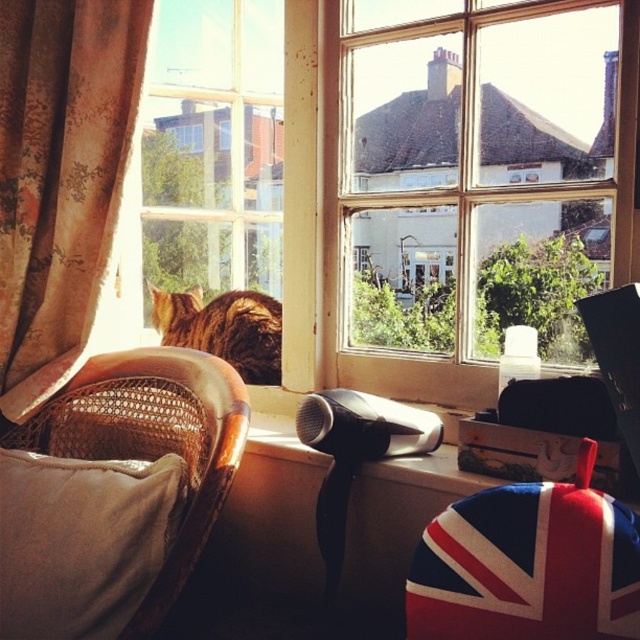
Question: Which object is closer to the camera taking this photo?

Choices:
 (A) beige fabric pillow at lower left
 (B) brown woven armchair at left

Answer: (B)

Question: Can you confirm if brown woven armchair at left is positioned below floral fabric curtain at left?

Choices:
 (A) yes
 (B) no

Answer: (A)

Question: Does wooden frame window at center have a lesser width compared to golden fur cat at left?

Choices:
 (A) no
 (B) yes

Answer: (A)

Question: Which of the following is the farthest from the observer?

Choices:
 (A) (42, 214)
 (B) (556, 8)

Answer: (A)

Question: Among these points, which one is farthest from the camera?

Choices:
 (A) (77, 28)
 (B) (403, 282)
 (C) (24, 572)
 (D) (198, 474)

Answer: (B)

Question: Where is floral fabric curtain at left located in relation to golden fur cat at left in the image?

Choices:
 (A) below
 (B) above

Answer: (B)